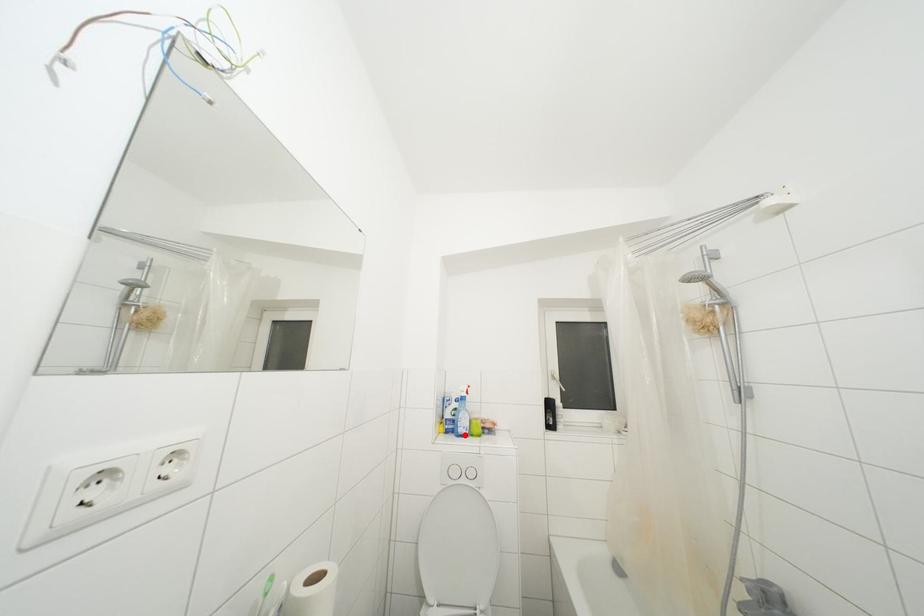
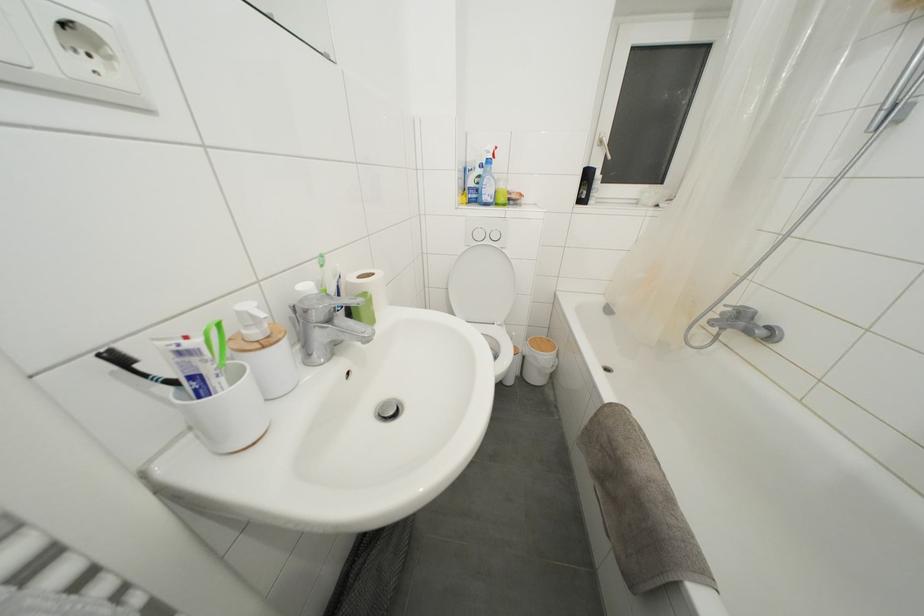
Where in the second image is the point corresponding to the highlighted location from the first image?

(490, 203)